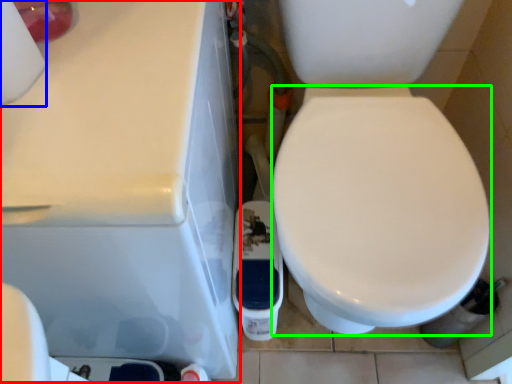
Question: Estimate the real-world distances between objects in this image. Which object is closer to porcelain (highlighted by a red box), toilet paper (highlighted by a blue box) or bidet (highlighted by a green box)?

Choices:
 (A) toilet paper
 (B) bidet

Answer: (A)